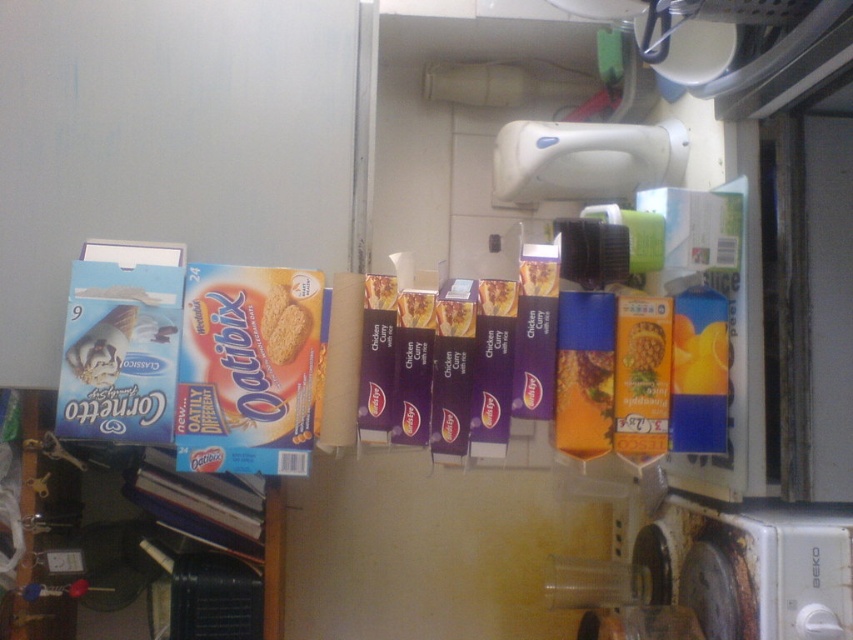
Based on the photo, who is shorter, rusty metal stove at lower right or matte cardboard oatibix at center?

With less height is matte cardboard oatibix at center.

Between rusty metal stove at lower right and matte cardboard oatibix at center, which one is positioned lower?

rusty metal stove at lower right is lower down.

Does point (741, 508) come behind point (283, 294)?

Yes, point (741, 508) is behind point (283, 294).

I want to click on rusty metal stove at lower right, so click(x=729, y=570).

Between point (106, 561) and point (509, 300), which one is positioned behind?

The point (106, 561) is more distant.

Does blue cardboard box at left have a lesser height compared to matte cardboard box at center?

In fact, blue cardboard box at left may be taller than matte cardboard box at center.

Between point (15, 586) and point (512, 316), which one is positioned behind?

The point (15, 586) is more distant.

The image size is (853, 640). Find the location of `blue cardboard box at left`. blue cardboard box at left is located at coordinates (126, 540).

Is blue cardboard box at left bigger than matte cardboard oatibix at center?

Yes, blue cardboard box at left is bigger than matte cardboard oatibix at center.

Does blue cardboard box at left lie in front of matte cardboard oatibix at center?

No, it is not.

Locate an element on the screen. This screenshot has width=853, height=640. blue cardboard box at left is located at coordinates (126, 540).